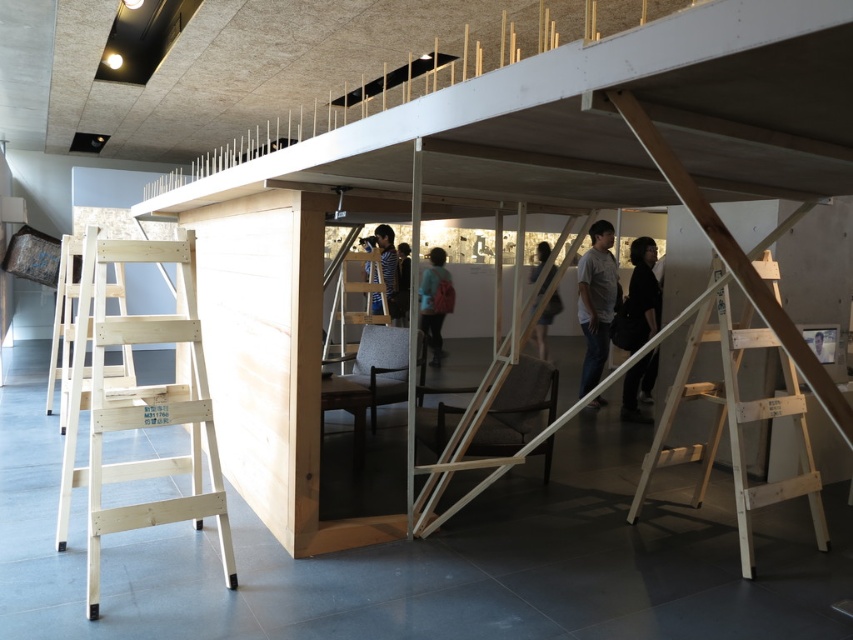
You are standing in the exhibition space and notice the wooden tripod at center and the dark blue shirt at center. From your perspective, which object is positioned to the left?

The wooden tripod at center is to the left of dark blue shirt at center.

You are standing at the entrance of the structure and want to reach the top of the wooden ladder at center. Based on the coordinates provided, is the ladder positioned in the central area of the structure?

The wooden ladder at center is located at point coordinates (363, 296), which places it centrally within the structure.

You need to climb a ladder to reach the upper part of the structure. Which ladder, the light brown wooden ladder at right or the wooden ladder at center, would you choose and why?

You should choose the wooden ladder at center because it is larger than the light brown wooden ladder at right, making it more stable and suitable for climbing to the upper part of the structure.